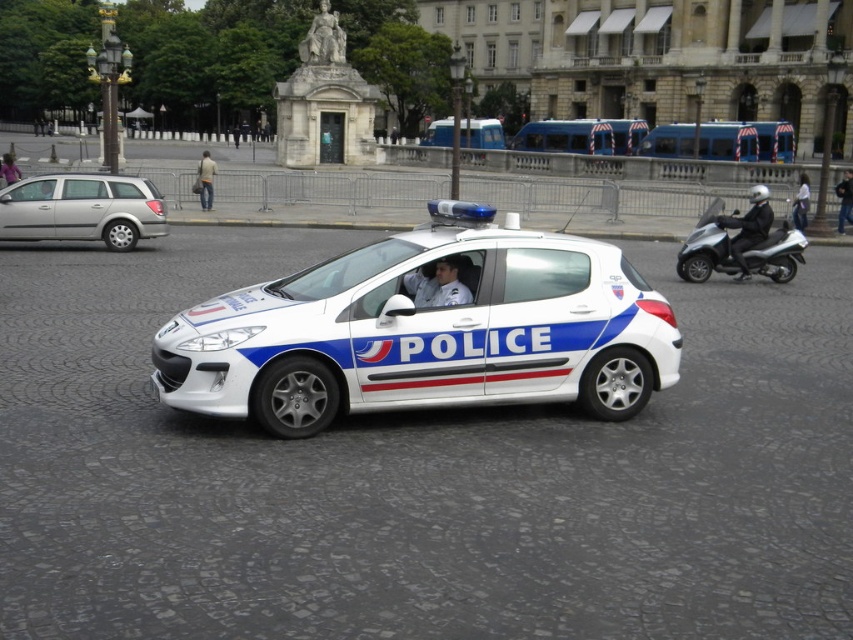
Based on the photo, is white glossy police car at center positioned before blue metallic bus at center?

Yes.

You are a GUI agent. You are given a task and a screenshot of the screen. Output one action in this format:
    pyautogui.click(x=<x>, y=<y>)
    Task: Click on the white glossy police car at center
    
    Given the screenshot: What is the action you would take?
    pyautogui.click(x=426, y=330)

Where is `white glossy police car at center`? The width and height of the screenshot is (853, 640). white glossy police car at center is located at coordinates (426, 330).

Is white glossy police car at center shorter than white glossy motorcycle at right?

Correct, white glossy police car at center is not as tall as white glossy motorcycle at right.

Which is behind, point (672, 381) or point (741, 228)?

Point (741, 228)

Is point (529, 323) closer to camera compared to point (730, 220)?

Yes, point (529, 323) is closer to viewer.

Find the location of `white glossy police car at center`. white glossy police car at center is located at coordinates (426, 330).

Who is shorter, silver metallic station wagon at left or white glossy motorcycle at right?

Standing shorter between the two is silver metallic station wagon at left.

Between point (21, 236) and point (732, 250), which one is positioned in front?

Point (732, 250) is in front.

You are a GUI agent. You are given a task and a screenshot of the screen. Output one action in this format:
    pyautogui.click(x=<x>, y=<y>)
    Task: Click on the silver metallic station wagon at left
    This screenshot has height=640, width=853.
    Given the screenshot: What is the action you would take?
    pyautogui.click(x=82, y=209)